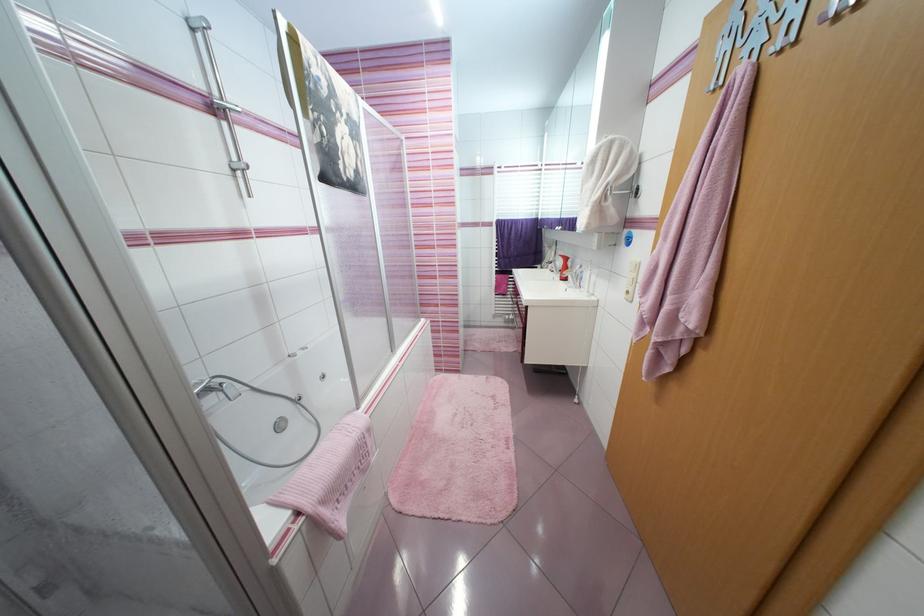
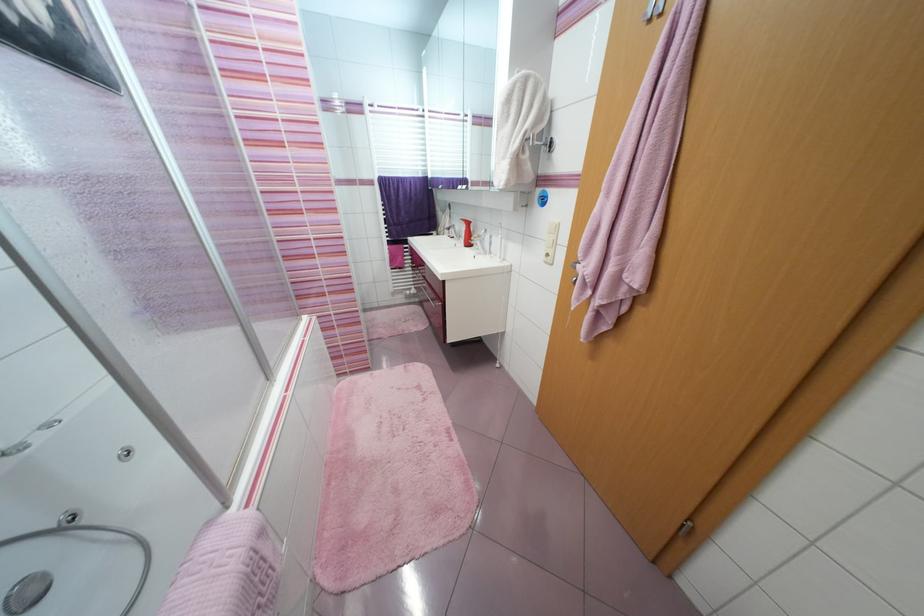
Find the pixel in the second image that matches point (529, 306) in the first image.

(445, 281)